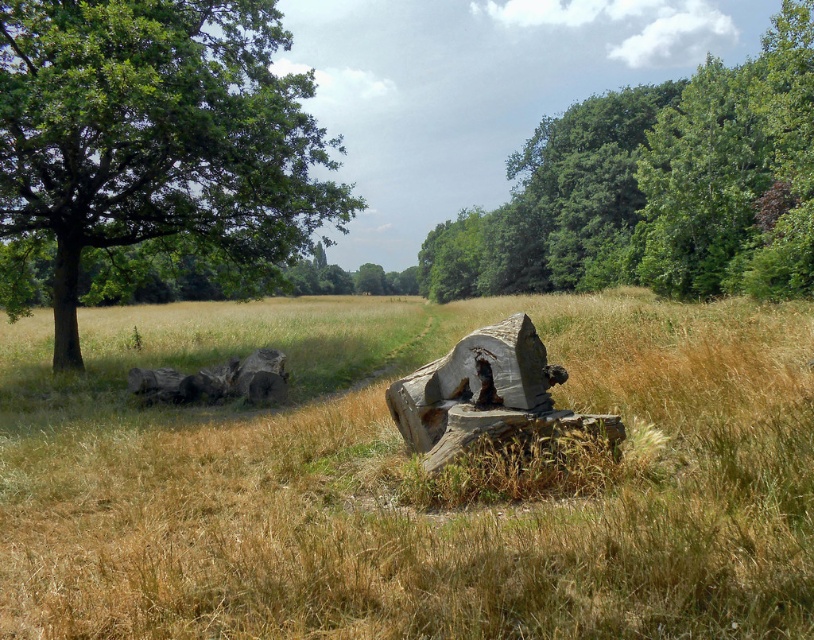
Does weathered wood stump at center appear on the right side of brown rough tree trunk at left?

Yes, weathered wood stump at center is to the right of brown rough tree trunk at left.

Who is more distant from viewer, (441,461) or (75,328)?

Positioned behind is point (75,328).

Where is `weathered wood stump at center`? weathered wood stump at center is located at coordinates (486, 396).

Who is higher up, brown dry grass at center or weathered wood stump at center?

brown dry grass at center

How much distance is there between brown dry grass at center and weathered wood stump at center?

brown dry grass at center is 6.40 meters away from weathered wood stump at center.

Is point (309, 358) positioned before point (423, 390)?

No, (309, 358) is further to viewer.

Where is `brown dry grass at center`? brown dry grass at center is located at coordinates (410, 480).

Is point (694, 141) in front of point (68, 282)?

No, it is not.

Between green leafy tree at upper center and brown rough tree trunk at left, which one has less height?

brown rough tree trunk at left is shorter.

At what (x,y) coordinates should I click in order to perform the action: click on green leafy tree at upper center. Please return your answer as a coordinate pair (x, y). The width and height of the screenshot is (814, 640). Looking at the image, I should click on (655, 188).